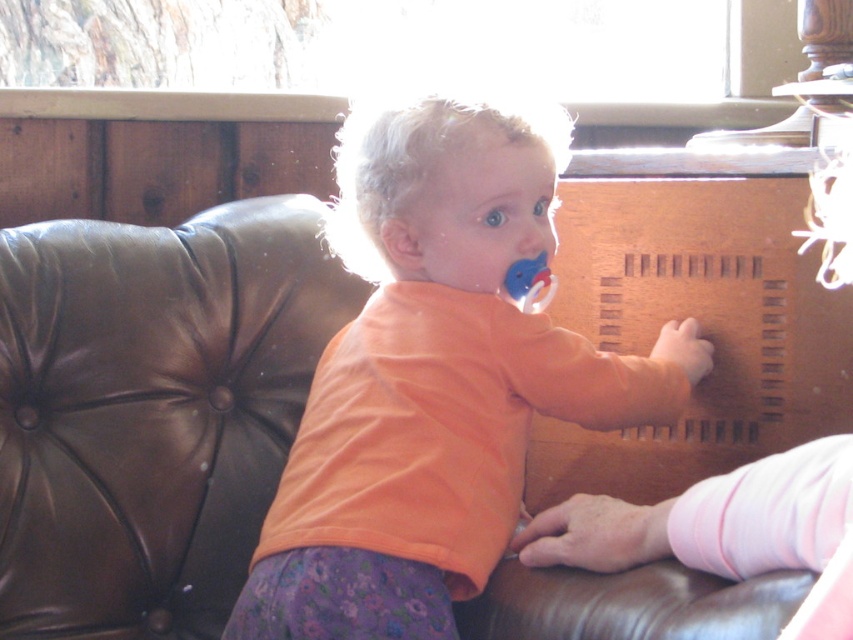
Question: Which point is closer to the camera?

Choices:
 (A) orange cotton shirt at center
 (B) blue rubber pacifier at upper center

Answer: (A)

Question: Does orange cotton shirt at center appear on the right side of blue rubber pacifier at upper center?

Choices:
 (A) yes
 (B) no

Answer: (B)

Question: Which of the following is the farthest from the observer?

Choices:
 (A) blue rubber pacifier at upper center
 (B) orange cotton shirt at center

Answer: (A)

Question: Can you confirm if orange cotton shirt at center is wider than blue rubber pacifier at upper center?

Choices:
 (A) yes
 (B) no

Answer: (A)

Question: Is orange cotton shirt at center closer to the viewer compared to blue rubber pacifier at upper center?

Choices:
 (A) no
 (B) yes

Answer: (B)